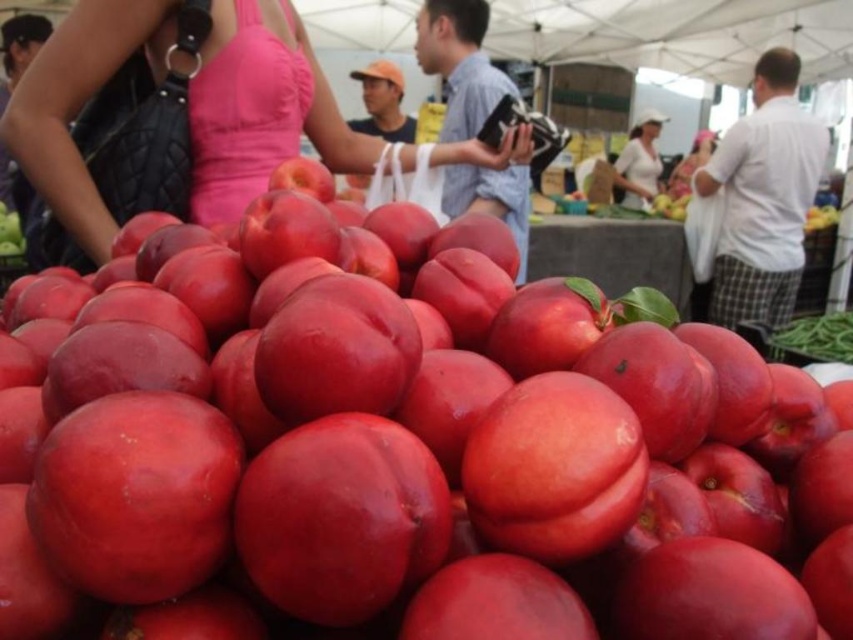
Question: Is matte pink dress at upper center positioned behind white matte shirt at upper center?

Choices:
 (A) yes
 (B) no

Answer: (B)

Question: Is matte pink dress at upper center bigger than white matte shirt at upper center?

Choices:
 (A) yes
 (B) no

Answer: (A)

Question: Is matte pink dress at upper center above white matte shirt at upper center?

Choices:
 (A) no
 (B) yes

Answer: (A)